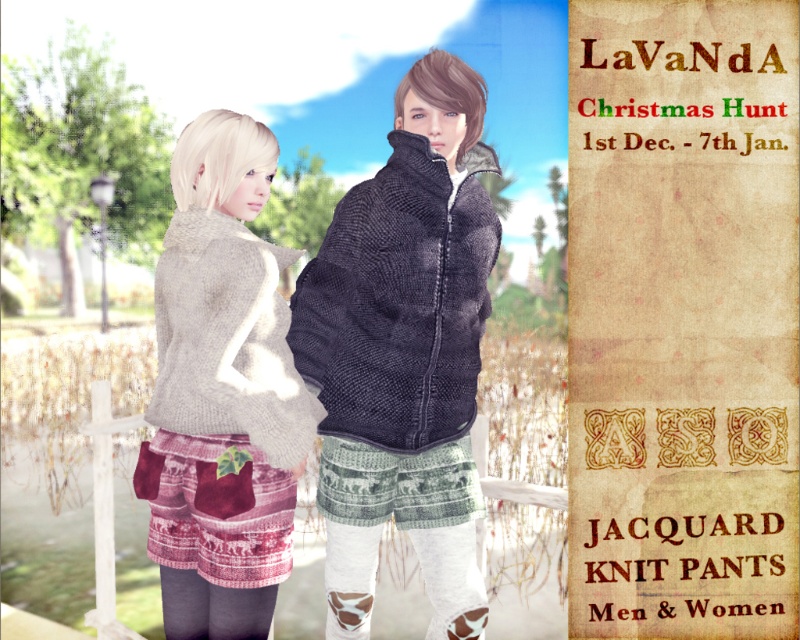
Based on the photo, you are designing a virtual outfit for an avatar and have two items to place on them. The jacquard knit pants at right and the knitted wool sweater at center. If you want to ensure the pants are wider than the sweater, which item should you place first to maintain the width difference?

The jacquard knit pants at right are already wider than the knitted wool sweater at center, so you should place the jacquard knit pants at right first to maintain their width difference.

In the image of the LaVaNdA Christmas Hunt advertisement, you notice two clothing items at the center of the scene. The first is a dark gray knitted jacket at center, and the second is a knitted gray sweater at center. Which of these two items is bigger in size?

The dark gray knitted jacket at center is larger in size compared to the knitted gray sweater at center.